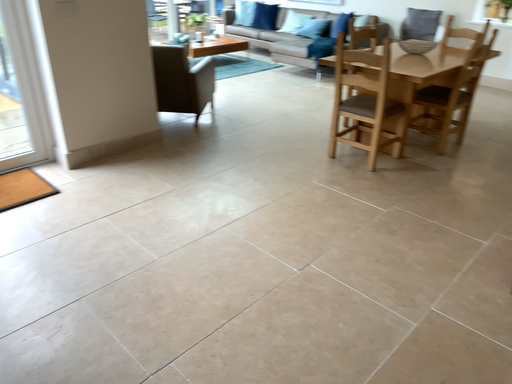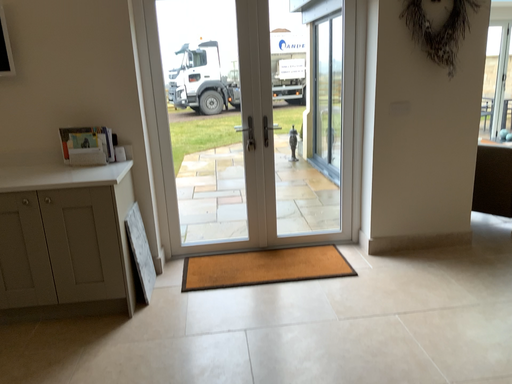
Question: Which way did the camera rotate in the video?

Choices:
 (A) rotated downward
 (B) rotated upward

Answer: (B)